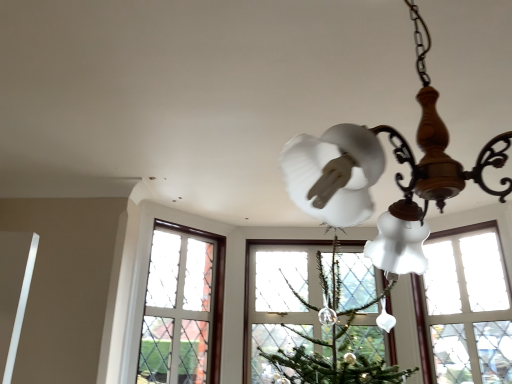
Question: Is matte white glass chandelier at upper right not near clear glass window at center?

Choices:
 (A) no
 (B) yes

Answer: (B)

Question: Is matte white glass chandelier at upper right smaller than clear glass window at center?

Choices:
 (A) yes
 (B) no

Answer: (B)

Question: Is matte white glass chandelier at upper right outside of clear glass window at center?

Choices:
 (A) yes
 (B) no

Answer: (A)

Question: Could clear glass window at center be considered to be inside matte white glass chandelier at upper right?

Choices:
 (A) no
 (B) yes

Answer: (A)

Question: Can you confirm if matte white glass chandelier at upper right is shorter than clear glass window at center?

Choices:
 (A) yes
 (B) no

Answer: (A)

Question: From the image's perspective, is matte white glass chandelier at upper right located above clear glass window at center?

Choices:
 (A) yes
 (B) no

Answer: (A)

Question: Is clear glass window at center facing away from matte white glass chandelier at upper right?

Choices:
 (A) no
 (B) yes

Answer: (A)

Question: From a real-world perspective, does clear glass window at center sit lower than matte white glass chandelier at upper right?

Choices:
 (A) yes
 (B) no

Answer: (A)

Question: Is clear glass window at center to the left of matte white glass chandelier at upper right from the viewer's perspective?

Choices:
 (A) no
 (B) yes

Answer: (A)

Question: Is clear glass window at center located outside matte white glass chandelier at upper right?

Choices:
 (A) no
 (B) yes

Answer: (B)

Question: Is clear glass window at center positioned behind matte white glass chandelier at upper right?

Choices:
 (A) no
 (B) yes

Answer: (B)

Question: Does clear glass window at center appear on the right side of matte white glass chandelier at upper right?

Choices:
 (A) no
 (B) yes

Answer: (B)

Question: In the image, is matte white glass chandelier at upper right positioned in front of or behind clear glass window at center?

Choices:
 (A) front
 (B) behind

Answer: (A)